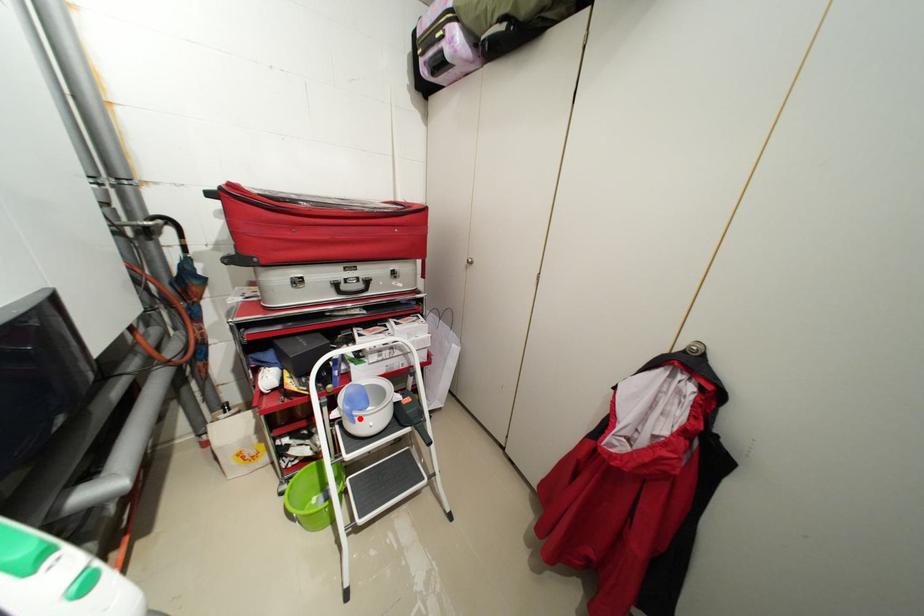
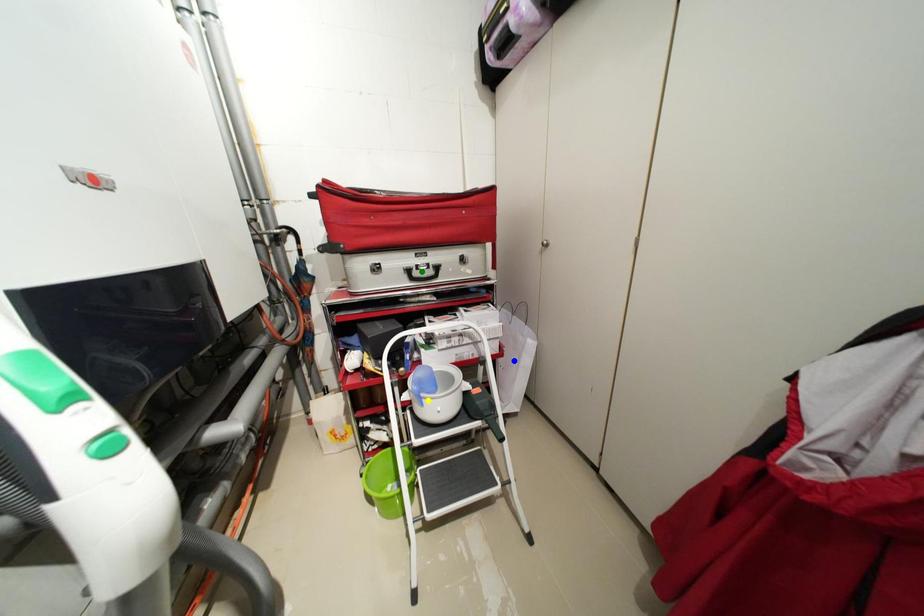
Question: I am providing you with two images of the same scene from different viewpoints. A red point is marked on the first image. You are given multiple points on the second image. Which point in image 2 is actually the same real-world point as the red point in image 1?

Choices:
 (A) blue point
 (B) green point
 (C) yellow point

Answer: (C)